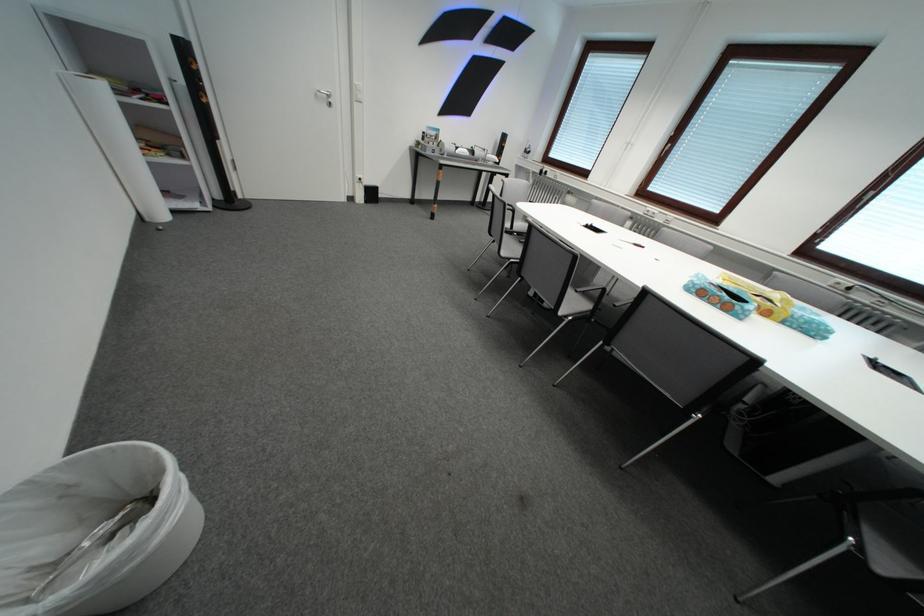
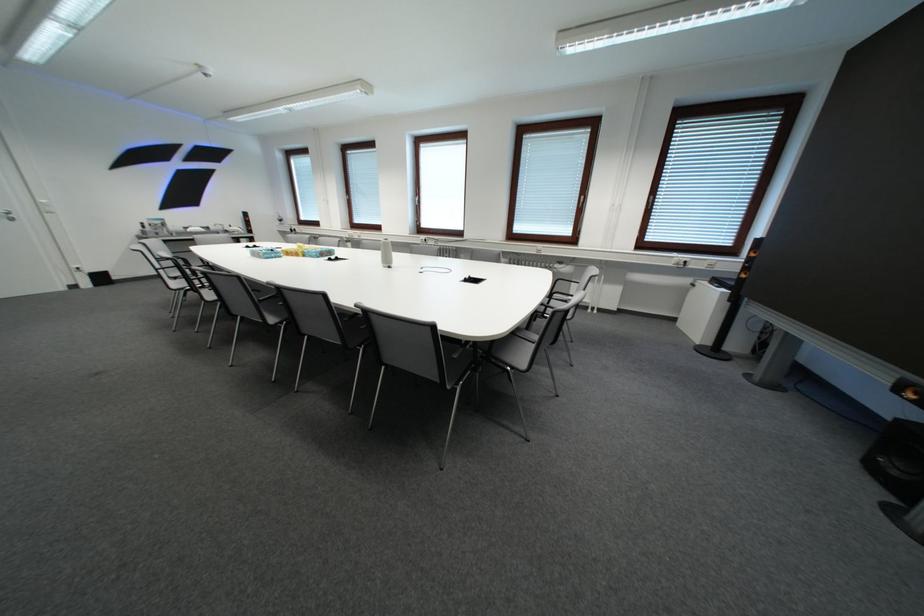
Find the pixel in the second image that matches pixel 776 315 in the first image.

(307, 257)